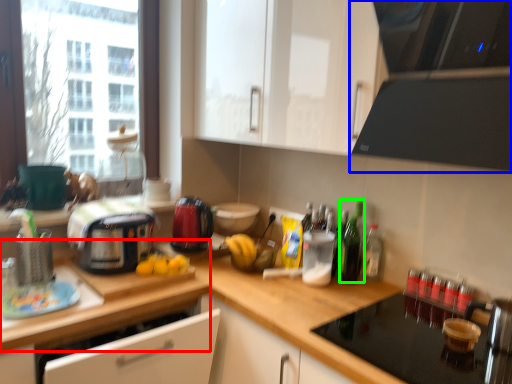
Question: Which object is positioned closest to countertop (highlighted by a red box)? Select from home appliance (highlighted by a blue box) and bottle (highlighted by a green box).

Choices:
 (A) home appliance
 (B) bottle

Answer: (B)